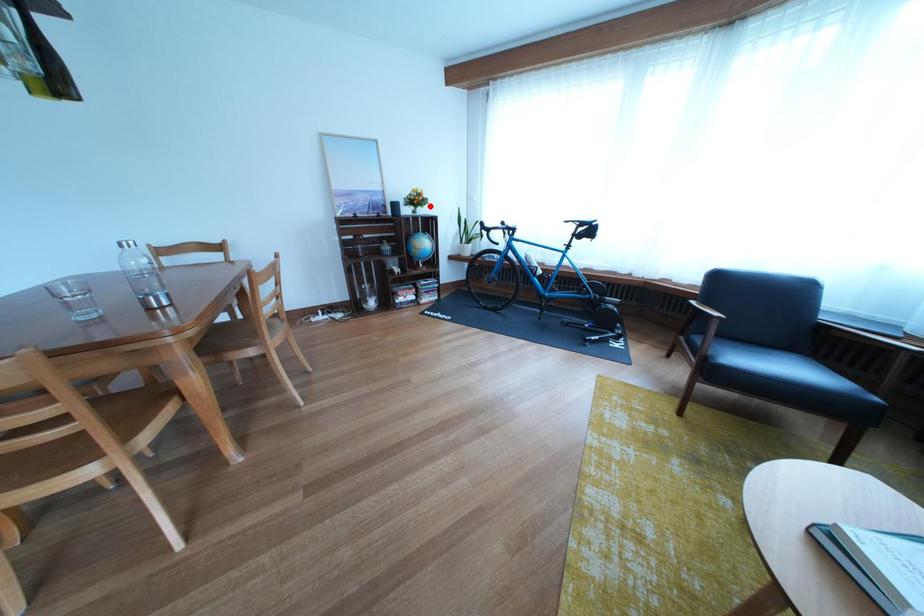
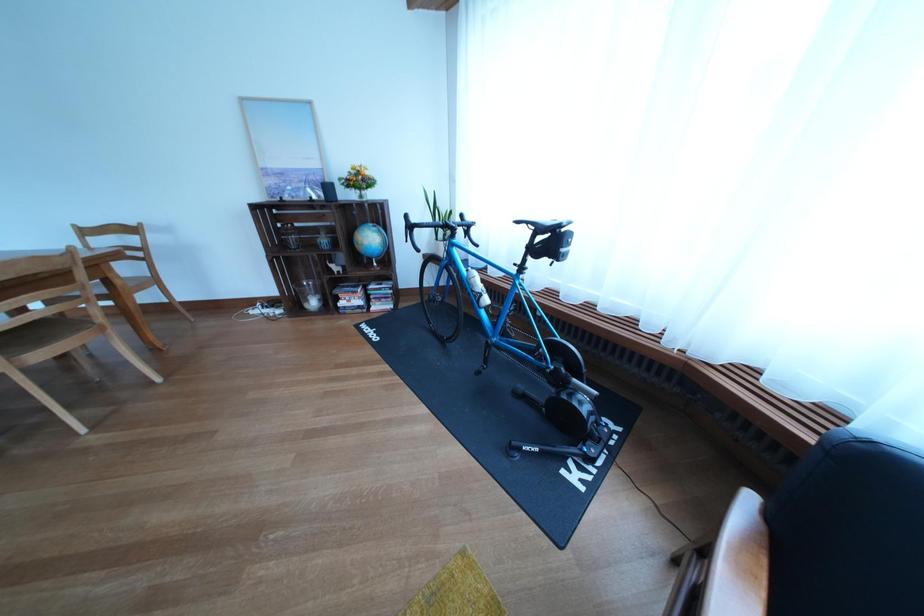
Where in the second image is the point corresponding to the highlighted location from the first image?

(372, 185)